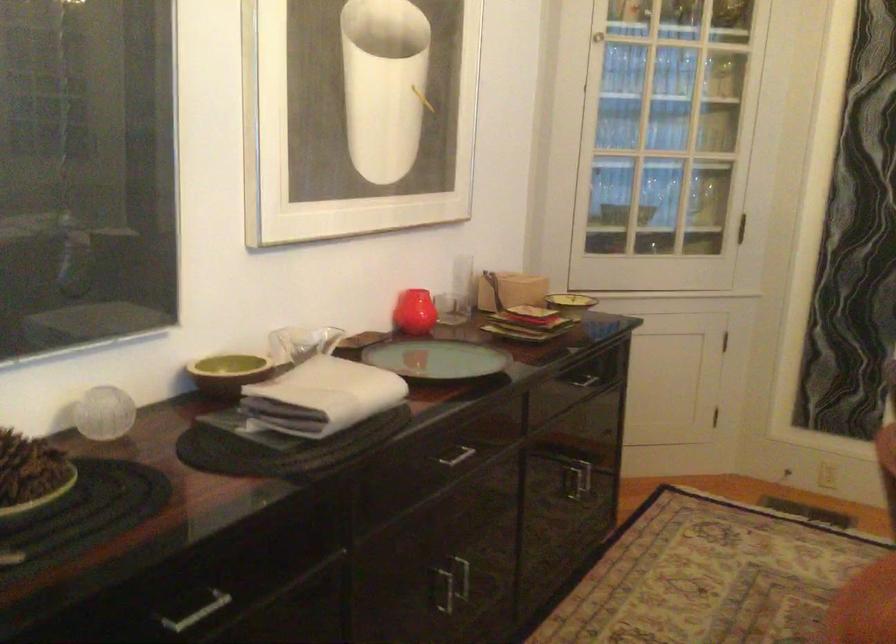
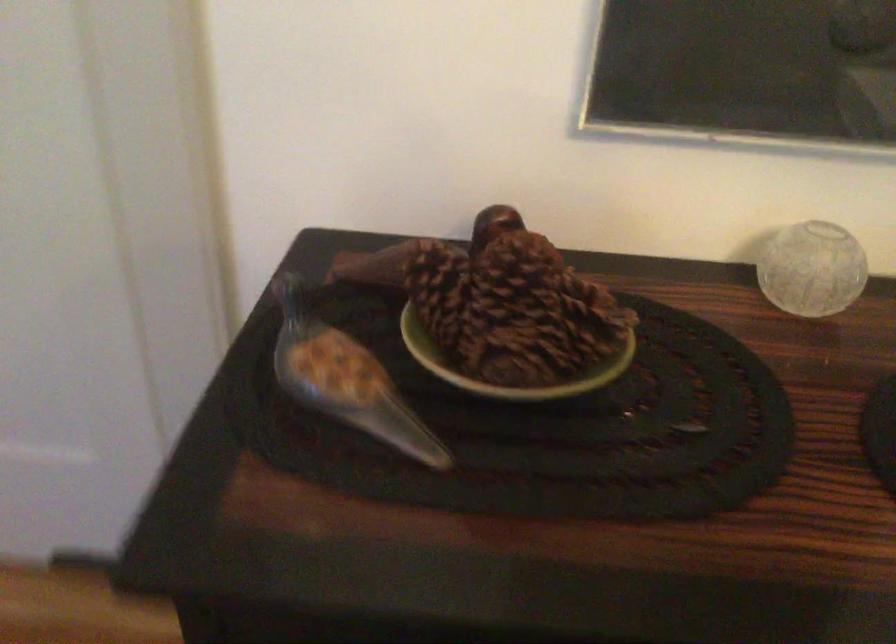
The first image is from the beginning of the video and the second image is from the end. How did the camera likely rotate when shooting the video?

The rotation direction of the camera is left-down.